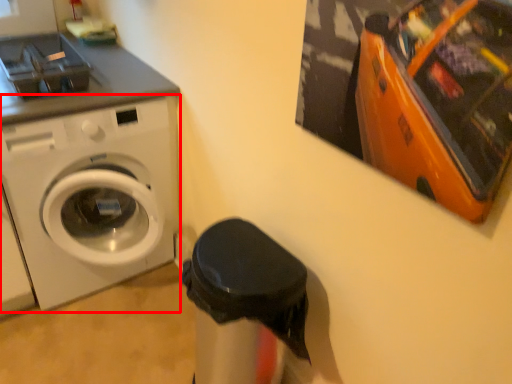
Question: Considering the relative positions of washing machine (annotated by the red box) and garbage in the image provided, where is washing machine (annotated by the red box) located with respect to the staircase?

Choices:
 (A) right
 (B) left

Answer: (B)